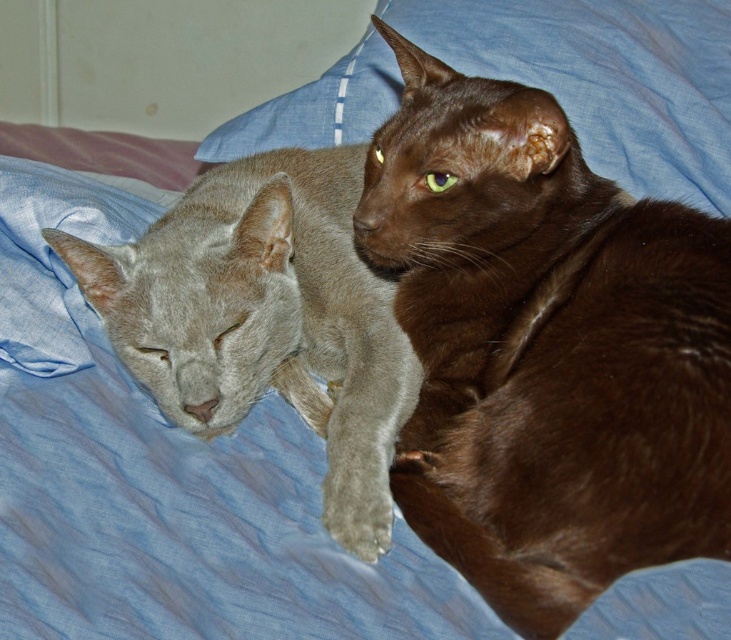
You are a cat owner who wants to place a new toy between the satin gray cat at left and the blue fabric pillow at upper center. Given that the toy requires 18 inches of space, will there be enough room?

The distance between the satin gray cat at left and the blue fabric pillow at upper center is 17.51 inches, which is slightly less than the required 18 inches. Therefore, there is not enough space to place the toy between them.

You are a photographer trying to capture a closeup of the brown silky cat at upper right without moving the blue fabric pillow at upper center. Based on their positions, can you tell me if the cat is positioned to the right or left side of the pillow?

The brown silky cat at upper right is to the right of the blue fabric pillow at upper center.

You are a photographer trying to capture a closeup of the brown silky cat at upper right. The camera you are using has a focal length of 50mm. To ensure the cat fills the frame, you need to position yourself at a specific distance from the cat. Given that the cat is represented by the point at coordinates point (x=545, y=348), can you determine if you should move closer to or farther away from the cat to achieve the desired closeup?

The brown silky cat at upper right is represented by point (x=545, y=348). Since the coordinates are given as a single point, it indicates the cat is positioned at that exact location. To capture a closeup with a 50mm lens, you would need to move closer to the cat until it fills the frame, as the current position might be too far for the desired closeup.